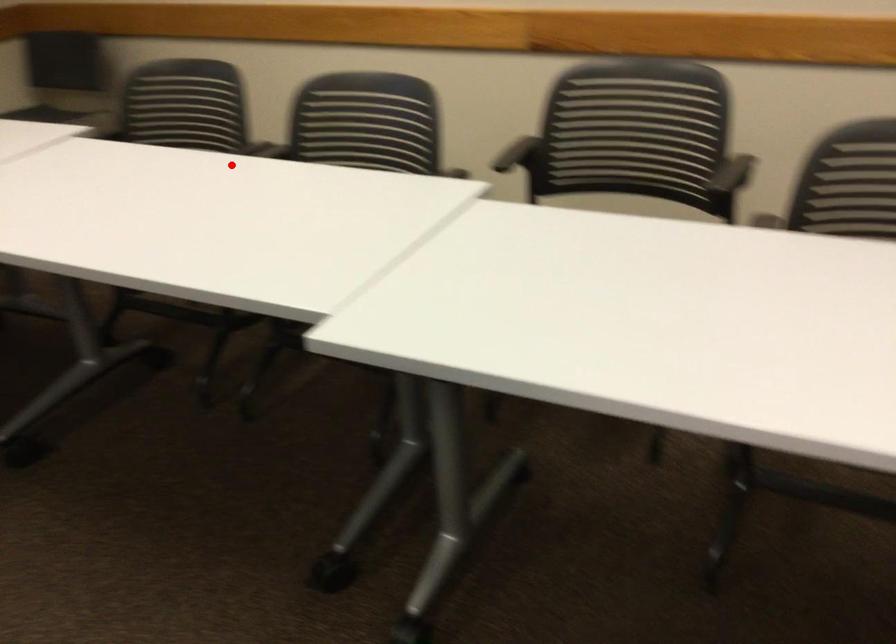
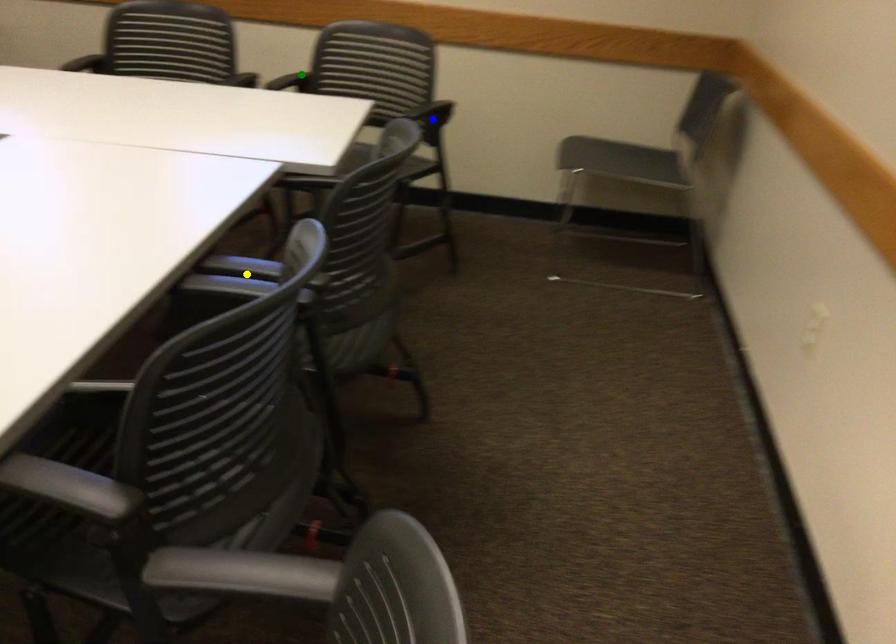
Question: I am providing you with two images of the same scene from different viewpoints. A red point is marked on the first image. You are given multiple points on the second image. Which spot in image 2 lines up with the point in image 1?

Choices:
 (A) yellow point
 (B) green point
 (C) blue point

Answer: (A)